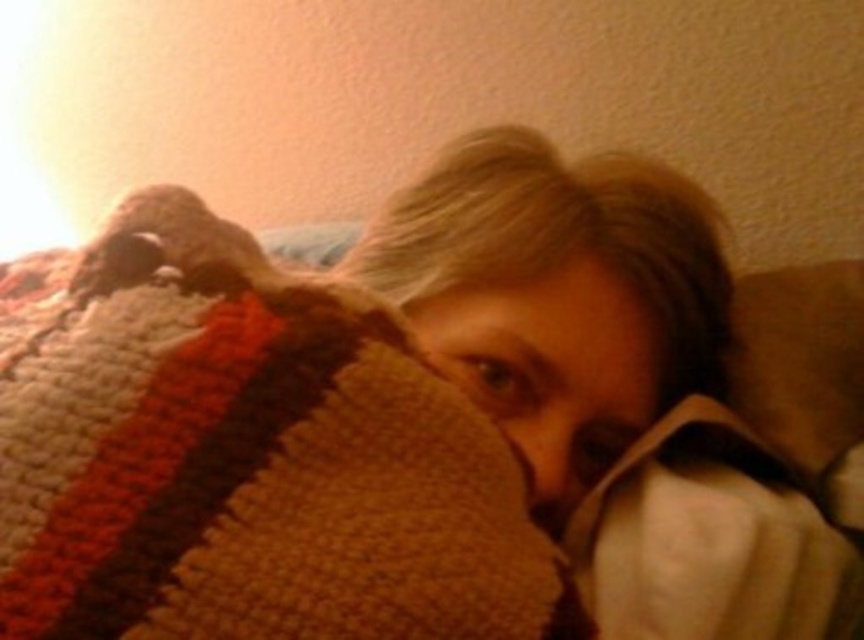
Question: Does knitted wool blanket at center have a larger size compared to smooth skin face at center?

Choices:
 (A) yes
 (B) no

Answer: (A)

Question: Observing the image, what is the correct spatial positioning of knitted wool blanket at center in reference to smooth skin face at center?

Choices:
 (A) above
 (B) below

Answer: (A)

Question: Among these objects, which one is farthest from the camera?

Choices:
 (A) smooth skin face at center
 (B) knitted wool blanket at center

Answer: (A)

Question: Is knitted wool blanket at center in front of smooth skin face at center?

Choices:
 (A) no
 (B) yes

Answer: (B)